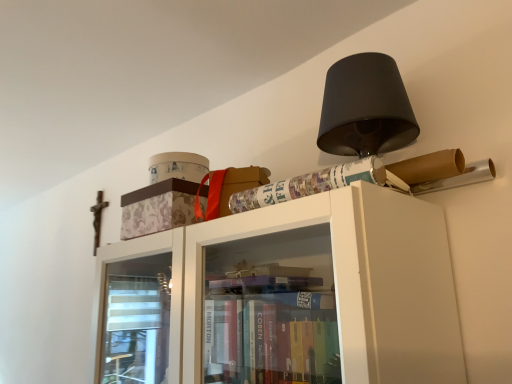
Question: Is patterned cardboard box at upper center situated inside patterned paper at upper right or outside?

Choices:
 (A) outside
 (B) inside

Answer: (A)

Question: Is patterned cardboard box at upper center bigger or smaller than patterned paper at upper right?

Choices:
 (A) big
 (B) small

Answer: (A)

Question: In terms of height, does patterned cardboard box at upper center look taller or shorter compared to patterned paper at upper right?

Choices:
 (A) short
 (B) tall

Answer: (B)

Question: Considering the positions of point (305, 190) and point (141, 193), is point (305, 190) closer or farther from the camera than point (141, 193)?

Choices:
 (A) closer
 (B) farther

Answer: (A)

Question: From a real-world perspective, relative to patterned cardboard box at upper center, is patterned paper at upper right vertically above or below?

Choices:
 (A) above
 (B) below

Answer: (B)

Question: From the image's perspective, is patterned paper at upper right positioned above or below patterned cardboard box at upper center?

Choices:
 (A) below
 (B) above

Answer: (B)

Question: Based on their positions, is patterned paper at upper right located to the left or right of patterned cardboard box at upper center?

Choices:
 (A) right
 (B) left

Answer: (A)